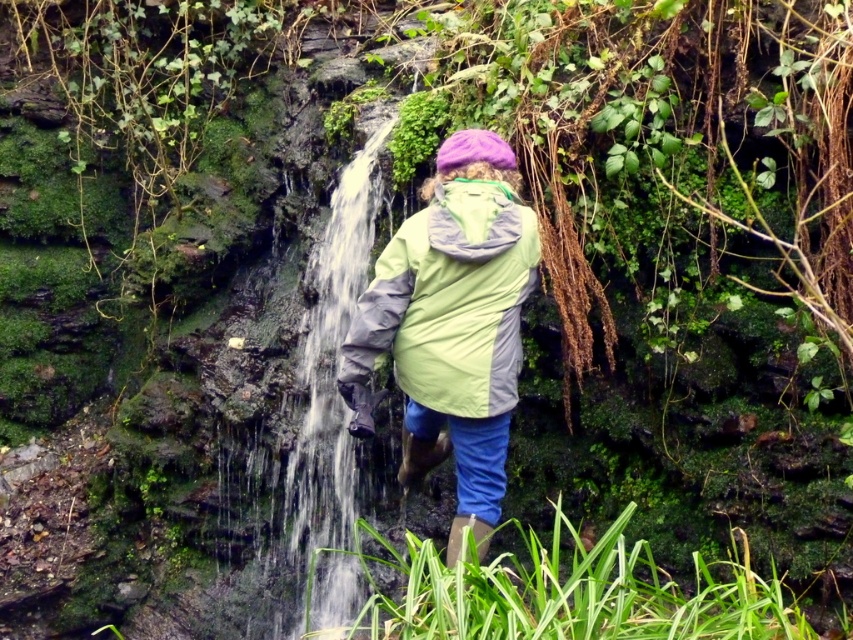
Question: Which object is farther from the camera taking this photo?

Choices:
 (A) clear water at center
 (B) green fabric jacket at center
 (C) green leafy grass at lower center

Answer: (A)

Question: Does green leafy grass at lower center have a smaller size compared to green fabric jacket at center?

Choices:
 (A) no
 (B) yes

Answer: (A)

Question: Can you confirm if green fabric jacket at center is thinner than clear water at center?

Choices:
 (A) yes
 (B) no

Answer: (A)

Question: Which point is farther to the camera?

Choices:
 (A) (248, 461)
 (B) (401, 301)

Answer: (A)

Question: Considering the relative positions of green fabric jacket at center and clear water at center in the image provided, where is green fabric jacket at center located with respect to clear water at center?

Choices:
 (A) right
 (B) left

Answer: (A)

Question: Which object is farther from the camera taking this photo?

Choices:
 (A) clear water at center
 (B) green fabric jacket at center
 (C) green leafy grass at lower center

Answer: (A)